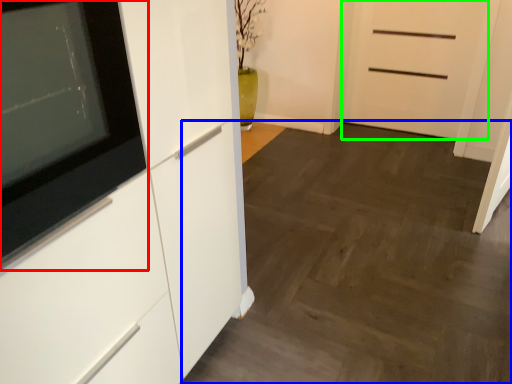
Question: Estimate the real-world distances between objects in this image. Which object is closer to appliance (highlighted by a red box), plain (highlighted by a blue box) or door (highlighted by a green box)?

Choices:
 (A) plain
 (B) door

Answer: (A)